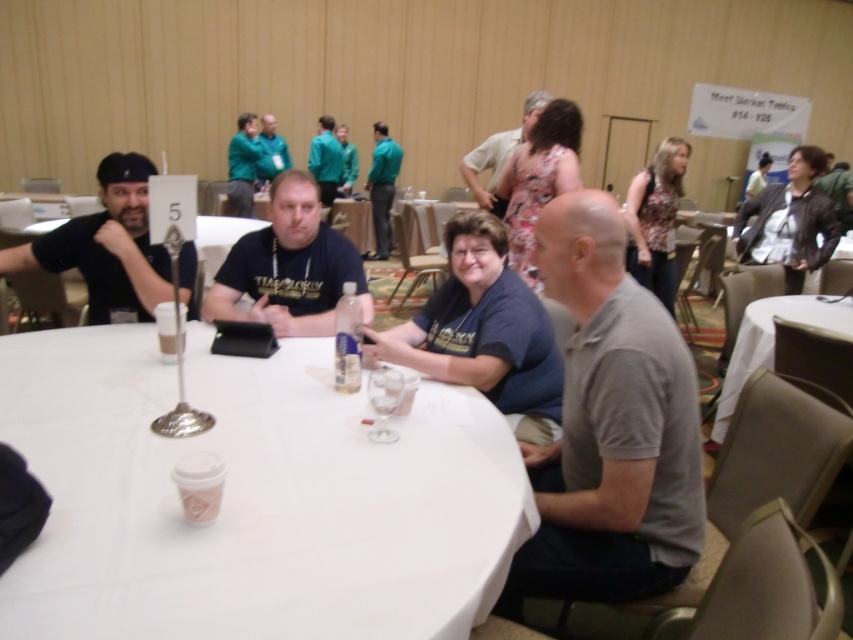
You are standing at the point marked as point (x=308, y=200). You want to walk to the nearest exit, which is 2.27 meters away. Is there enough space for you to move freely towards the exit without any obstacles?

The distance between you and the nearest exit is exactly 2.27 meters, so there is enough space to move freely towards the exit without any obstacles.

Where is the white matte table at center located in the image?

The white matte table at center is located at point coordinates of 0.777 on the x axis and 0.294 on the y axis.